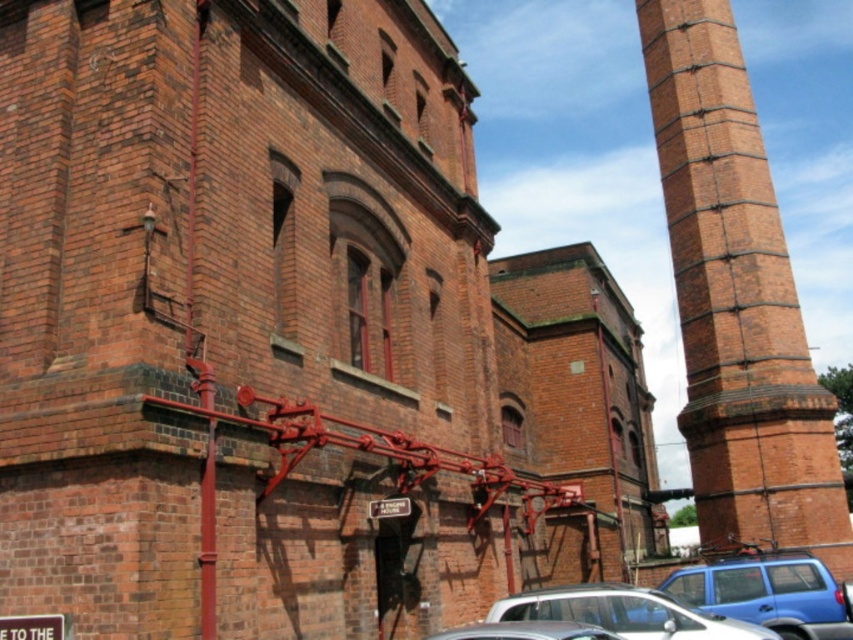
You are a delivery person trying to park your van between the blue matte car at lower right and the silver metallic car at lower center. Based on their positions, which car should you position your van closer to in order to fit properly?

The blue matte car at lower right is closer to the viewer than the silver metallic car at lower center. Therefore, positioning your van closer to the blue matte car at lower right would allow better visibility and space management between the two vehicles.

Looking at this image, you are standing in front of the brick building and looking at two points marked on the wall. The first point is at coordinates point (755, 561) and the second is at point (607, 589). Which point is closer to you?

Point (607, 589) is closer to you because it is less further to the camera than point (755, 561).

You are standing in front of a brick building and see a brick tower at right and a blue matte car at lower right. Which object is closer to you?

The brick tower at right is closer to you because it is further to the viewer than the blue matte car at lower right, meaning it appears nearer in the scene.